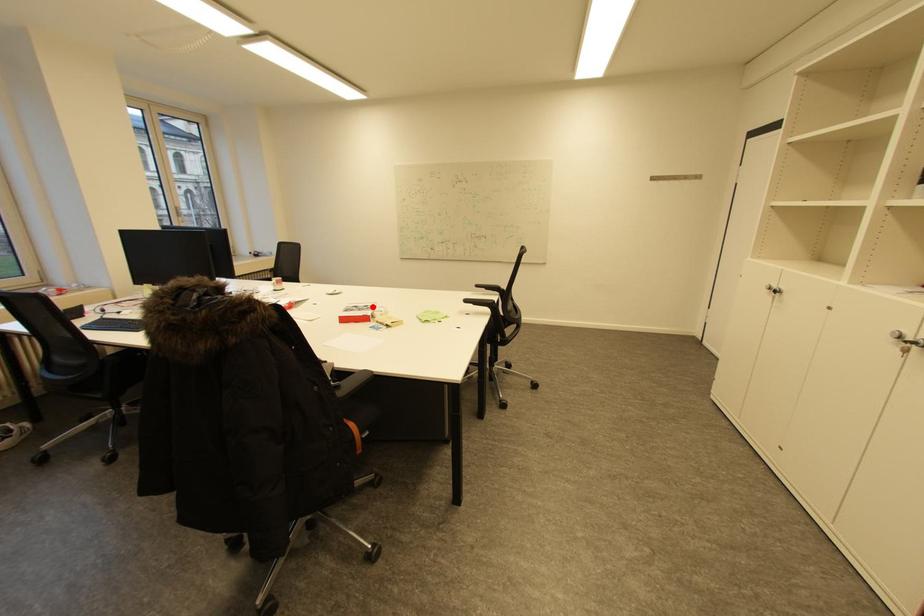
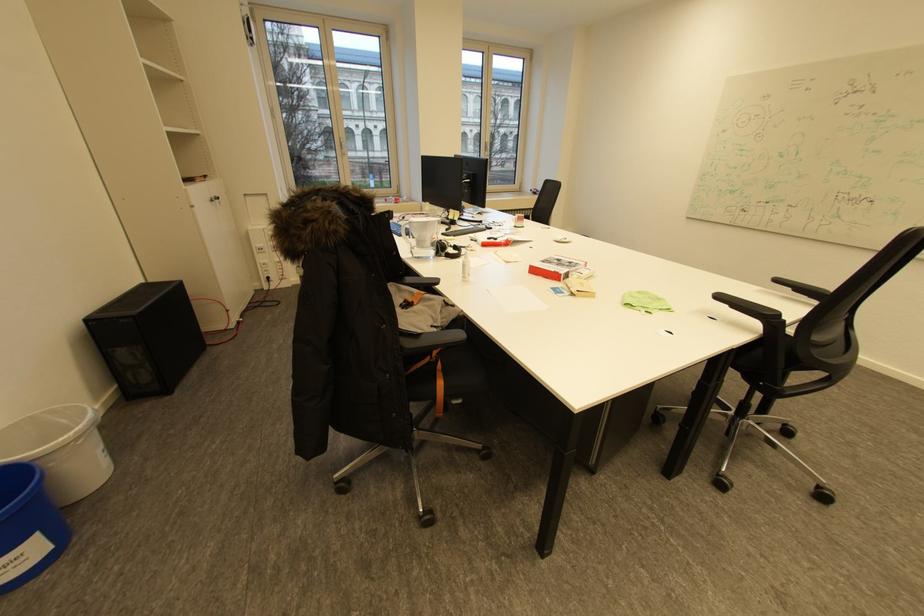
Locate, in the second image, the point that corresponds to the highlighted location in the first image.

(576, 262)